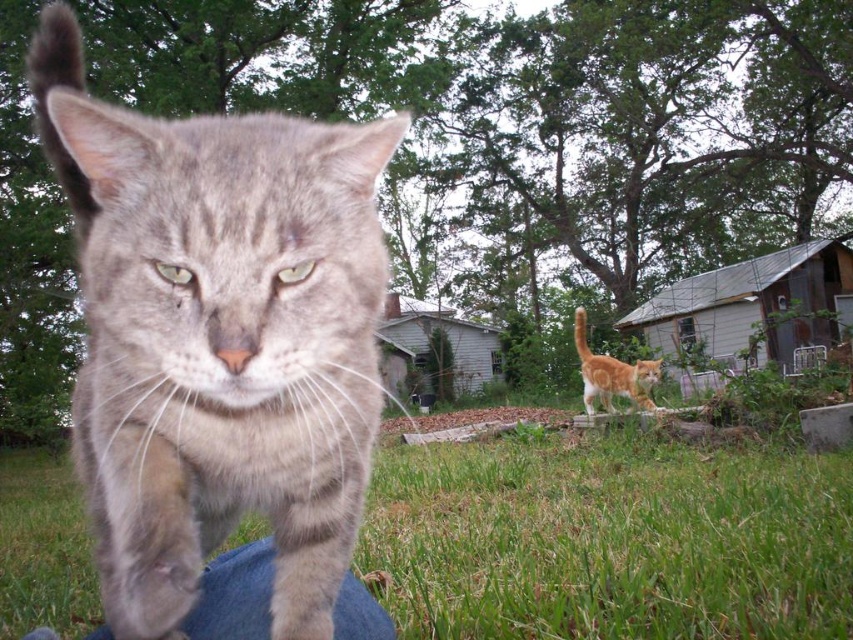
In order to click on gray striped cat at center in this screenshot , I will do `click(218, 337)`.

Who is taller, gray striped cat at center or green grass at lower center?

gray striped cat at center is taller.

Where is `gray striped cat at center`? The image size is (853, 640). gray striped cat at center is located at coordinates (218, 337).

Is green grass at lower center shorter than orange tabby cat at center?

Indeed, green grass at lower center has a lesser height compared to orange tabby cat at center.

Can you confirm if green grass at lower center is smaller than orange tabby cat at center?

Correct, green grass at lower center occupies less space than orange tabby cat at center.

Find the location of `green grass at lower center`. green grass at lower center is located at coordinates (610, 540).

In the scene shown: Can you confirm if gray striped cat at center is bigger than orange tabby cat at center?

No.

Who is positioned more to the right, gray striped cat at center or orange tabby cat at center?

orange tabby cat at center

Which is in front, point (315, 218) or point (577, 316)?

Positioned in front is point (315, 218).

Where is `gray striped cat at center`? Image resolution: width=853 pixels, height=640 pixels. gray striped cat at center is located at coordinates [218, 337].